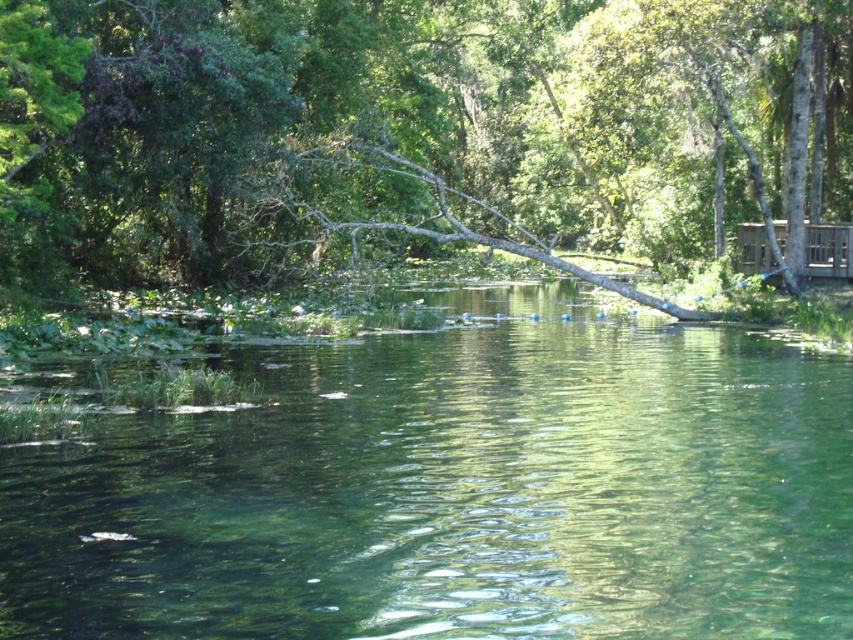
Question: Which point is farther to the camera?

Choices:
 (A) clear water at center
 (B) green leafy tree at center

Answer: (B)

Question: Which point is closer to the camera?

Choices:
 (A) wooden cabin at right
 (B) green leafy tree at center

Answer: (B)

Question: Is clear water at center wider than green leafy tree at center?

Choices:
 (A) no
 (B) yes

Answer: (A)

Question: Does clear water at center come in front of wooden cabin at right?

Choices:
 (A) yes
 (B) no

Answer: (A)

Question: Is green leafy tree at center bigger than wooden cabin at right?

Choices:
 (A) yes
 (B) no

Answer: (A)

Question: Which of the following is the farthest from the observer?

Choices:
 (A) (845, 236)
 (B) (113, 189)
 (C) (24, 620)

Answer: (A)